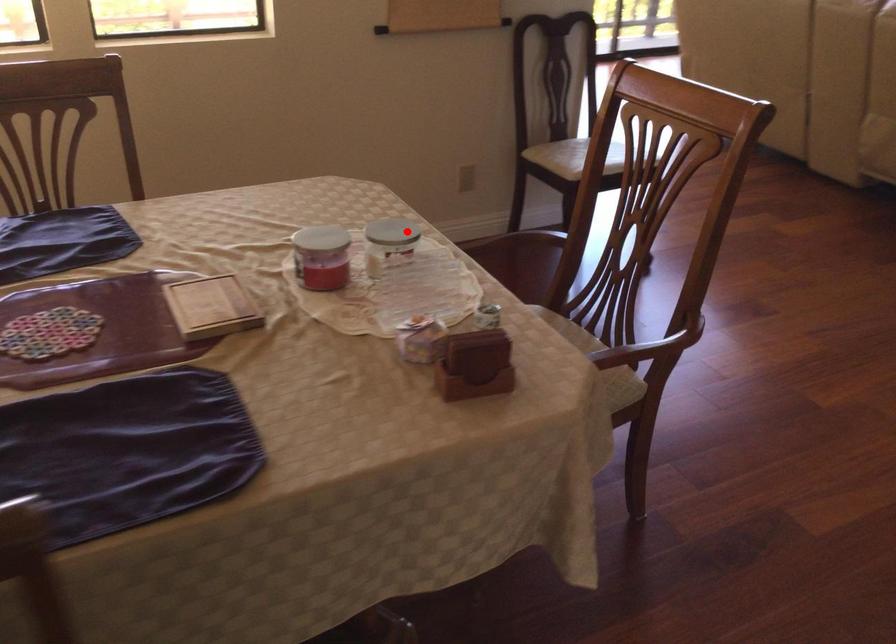
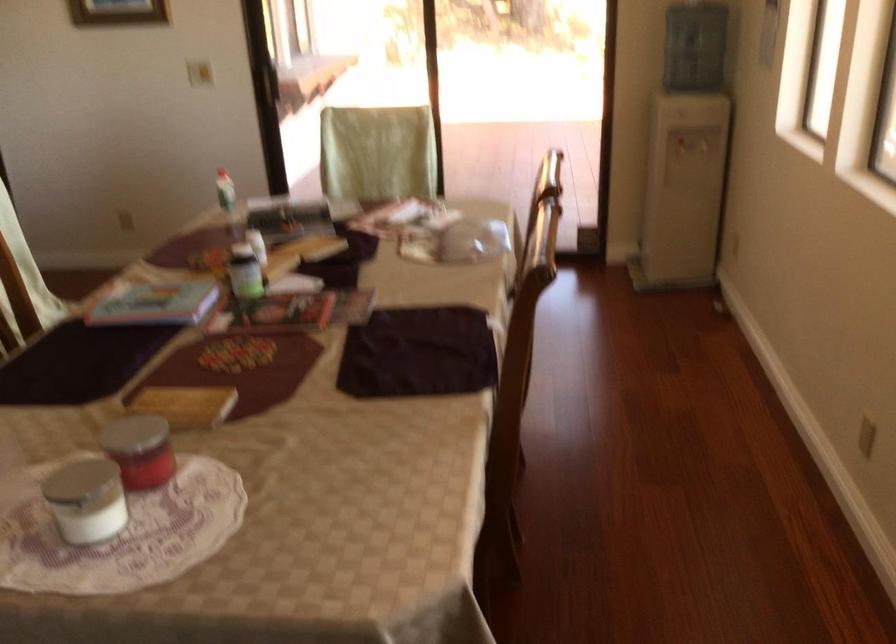
Question: I am providing you with two images of the same scene from different viewpoints. A red point is shown in image1. For the corresponding object point in image2, is it positioned nearer or farther from the camera?

Choices:
 (A) Nearer
 (B) Farther

Answer: (A)